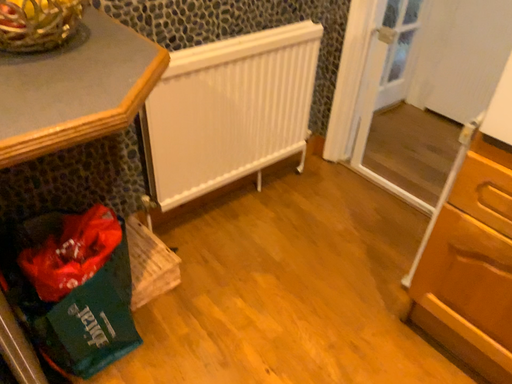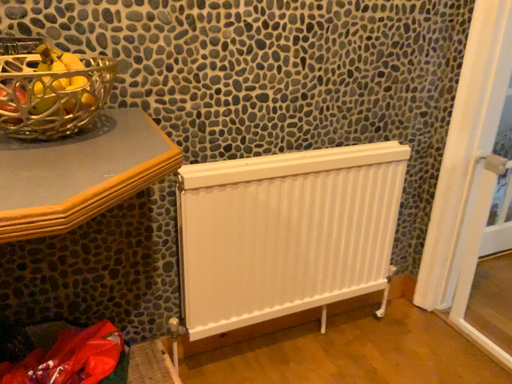
Question: How did the camera likely rotate when shooting the video?

Choices:
 (A) rotated right
 (B) rotated left

Answer: (B)